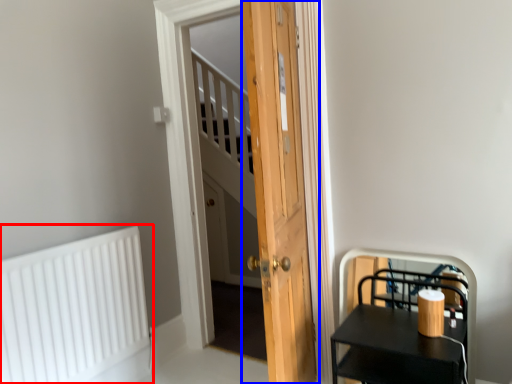
Question: Which point is closer to the camera, radiator (highlighted by a red box) or door (highlighted by a blue box)?

Choices:
 (A) radiator
 (B) door

Answer: (B)